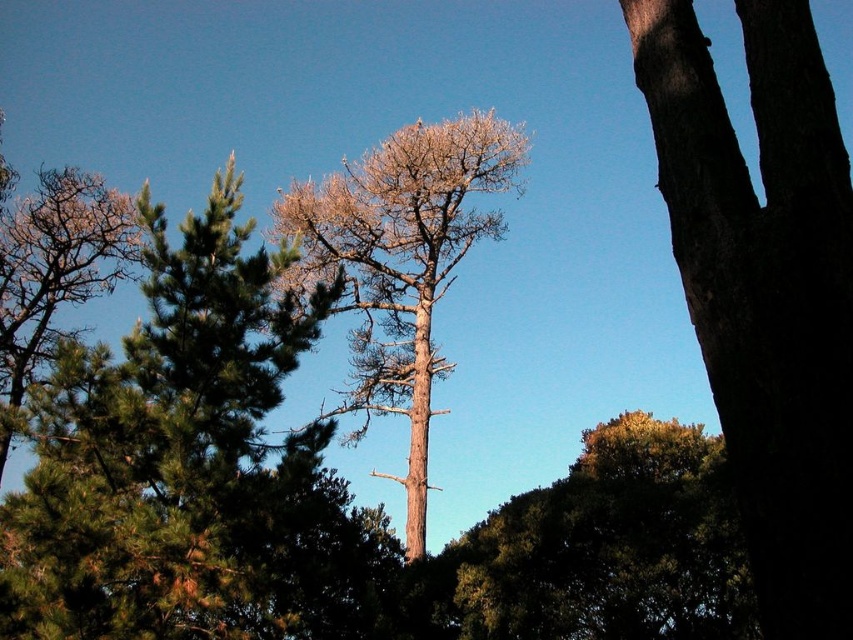
Question: Which point is closer to the camera?

Choices:
 (A) (730, 609)
 (B) (53, 179)
 (C) (369, 316)
 (D) (752, 468)

Answer: (D)

Question: Among these objects, which one is farthest from the camera?

Choices:
 (A) bare wood tree at left
 (B) dark brown bark tree at right
 (C) bare wood tree at center

Answer: (C)

Question: Can you confirm if dark brown bark tree at right is thinner than bare wood tree at center?

Choices:
 (A) yes
 (B) no

Answer: (A)

Question: Is dark brown bark tree at right to the left of green leafy tree at center from the viewer's perspective?

Choices:
 (A) no
 (B) yes

Answer: (B)

Question: Among these points, which one is nearest to the camera?

Choices:
 (A) (73, 291)
 (B) (648, 97)

Answer: (B)

Question: Does dark brown bark tree at right come behind bare wood tree at center?

Choices:
 (A) yes
 (B) no

Answer: (B)